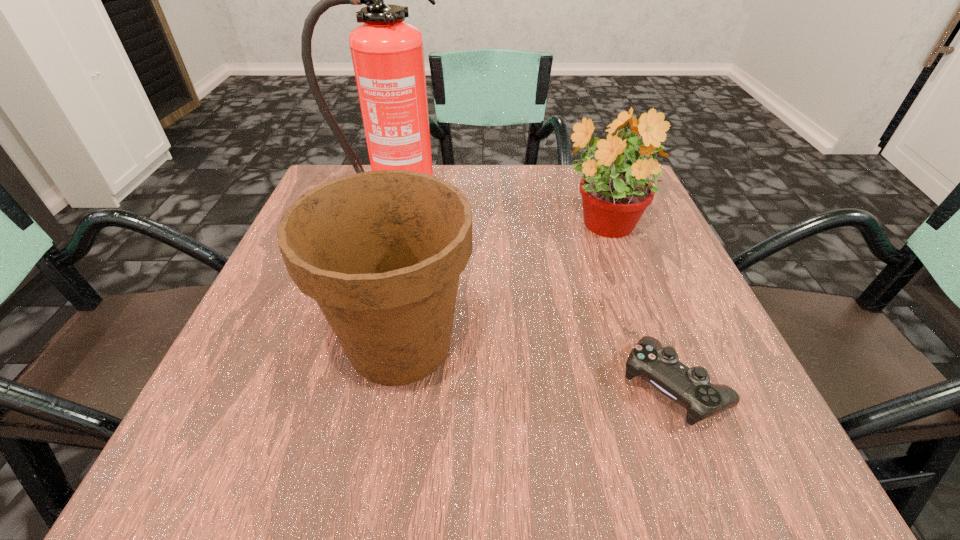
At what (x,y) coordinates should I click in order to perform the action: click on object at the near edge. Please return your answer as a coordinate pair (x, y). This screenshot has width=960, height=540. Looking at the image, I should click on (689, 387).

Locate an element on the screen. Image resolution: width=960 pixels, height=540 pixels. fire extinguisher that is positioned at the left edge is located at coordinates (387, 53).

Locate an element on the screen. flowerpot that is at the left edge is located at coordinates (381, 252).

I want to click on flowerpot that is at the right edge, so click(x=615, y=194).

What are the coordinates of `control situated at the right edge` in the screenshot? It's located at (689, 387).

You are a GUI agent. You are given a task and a screenshot of the screen. Output one action in this format:
    pyautogui.click(x=<x>, y=<y>)
    Task: Click on the object that is at the far left corner
    The height and width of the screenshot is (540, 960).
    Given the screenshot: What is the action you would take?
    pyautogui.click(x=387, y=53)

At what (x,y) coordinates should I click in order to perform the action: click on object at the far right corner. Please return your answer as a coordinate pair (x, y). This screenshot has width=960, height=540. Looking at the image, I should click on (615, 194).

Locate an element on the screen. object that is at the near right corner is located at coordinates (689, 387).

This screenshot has height=540, width=960. In the image, there is a desktop. What are the coordinates of `vacant space at the far edge` in the screenshot? It's located at (523, 179).

In the image, there is a desktop. At what (x,y) coordinates should I click in order to perform the action: click on free space at the near edge. Please return your answer as a coordinate pair (x, y). Looking at the image, I should click on (573, 473).